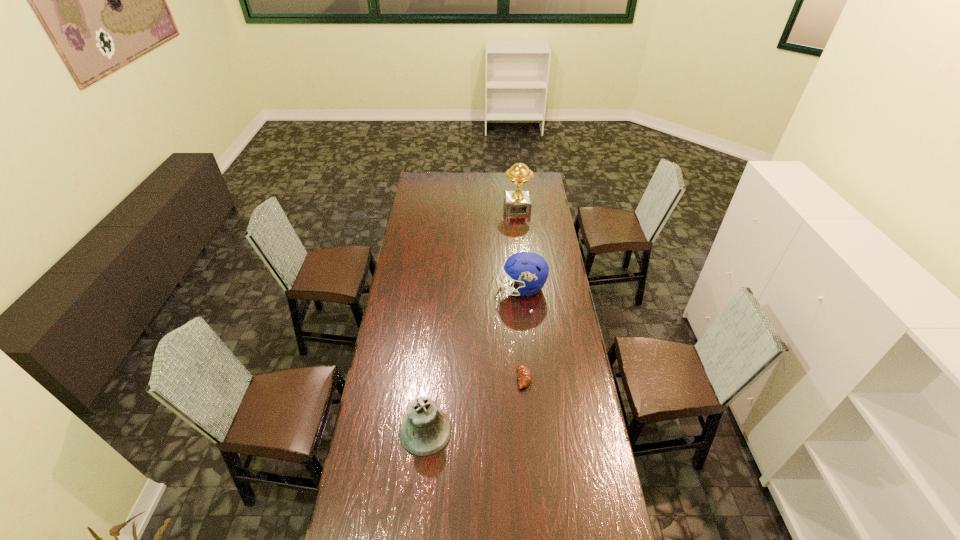
Locate an element on the screen. award is located at coordinates (517, 202).

The height and width of the screenshot is (540, 960). I want to click on the tallest object, so coord(517,202).

You are a GUI agent. You are given a task and a screenshot of the screen. Output one action in this format:
    pyautogui.click(x=<x>, y=<y>)
    Task: Click on the football helmet
    This screenshot has width=960, height=540.
    Given the screenshot: What is the action you would take?
    pyautogui.click(x=529, y=270)

Where is `bell`? This screenshot has width=960, height=540. bell is located at coordinates (426, 430).

This screenshot has height=540, width=960. Identify the location of the leftmost object. (426, 430).

Identify the location of the shortest object. This screenshot has width=960, height=540. (524, 375).

You are a GUI agent. You are given a task and a screenshot of the screen. Output one action in this format:
    pyautogui.click(x=<x>, y=<y>)
    Task: Click on the second nearest object
    The height and width of the screenshot is (540, 960).
    Given the screenshot: What is the action you would take?
    pyautogui.click(x=524, y=375)

Identify the location of free space located on the front-facing side of the tallest object. This screenshot has height=540, width=960. (520, 240).

You are a GUI agent. You are given a task and a screenshot of the screen. Output one action in this format:
    pyautogui.click(x=<x>, y=<y>)
    Task: Click on the vacant space located on the front-facing side of the third nearest object
    The image size is (960, 540).
    Given the screenshot: What is the action you would take?
    pyautogui.click(x=437, y=288)

Locate an element on the screen. This screenshot has height=540, width=960. vacant space situated 0.260m on the front-facing side of the third nearest object is located at coordinates (444, 288).